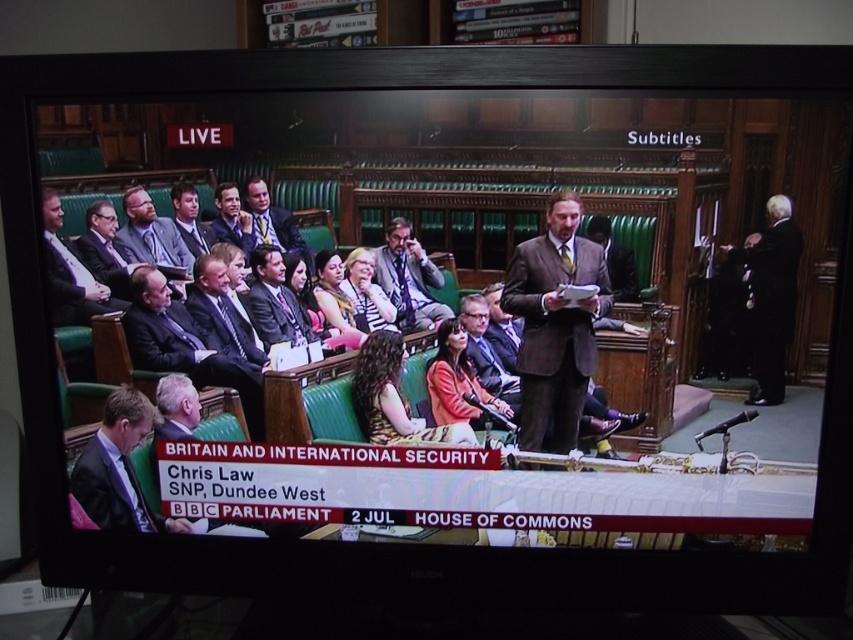
You are a photographer trying to capture a photo of the dark suit at lower left and the matte gray suit at center during the parliamentary debate. Based on their positions, which one would appear closer to the bottom edge of the photo?

The dark suit at lower left is below matte gray suit at center, so it would appear closer to the bottom edge of the photo.

You are a camera operator trying to capture a closeup of both the dark brown suit at center and the light brown suit at center. Which one should you zoom in on first to ensure they both fit in the frame?

The dark brown suit at center might be wider than the light brown suit at center, so you should zoom in on the dark brown suit at center first to accommodate its width before adjusting for the light brown suit at center.

You are a photographer positioned at the center of the House of Commons chamber. You want to take a photo of the dark suit at lower left. Which direction should you point your camera to capture it?

The dark suit at lower left is located at point (119, 467), so you should point your camera to the lower left direction to capture it.